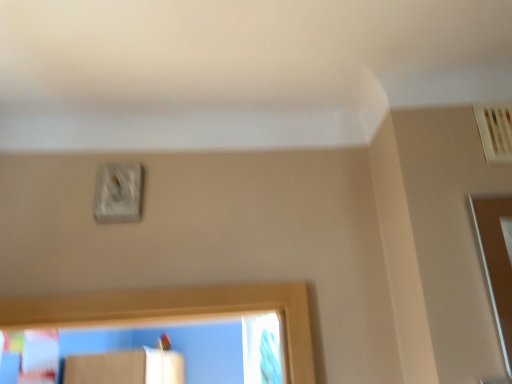
Question: Looking at their shapes, would you say clear glass screen door at right is wider or thinner than white textured switch at upper center?

Choices:
 (A) thin
 (B) wide

Answer: (B)

Question: From the image's perspective, is clear glass screen door at right positioned above or below white textured switch at upper center?

Choices:
 (A) above
 (B) below

Answer: (B)

Question: Considering the relative positions of clear glass screen door at right and white textured switch at upper center in the image provided, is clear glass screen door at right to the left or to the right of white textured switch at upper center?

Choices:
 (A) left
 (B) right

Answer: (B)

Question: Considering the relative positions of white textured switch at upper center and clear glass screen door at right in the image provided, is white textured switch at upper center to the left or to the right of clear glass screen door at right?

Choices:
 (A) left
 (B) right

Answer: (A)

Question: Looking at the image, does white textured switch at upper center seem bigger or smaller compared to clear glass screen door at right?

Choices:
 (A) big
 (B) small

Answer: (B)

Question: Is white textured switch at upper center spatially inside clear glass screen door at right, or outside of it?

Choices:
 (A) outside
 (B) inside

Answer: (A)

Question: From a real-world perspective, is white textured switch at upper center physically located above or below clear glass screen door at right?

Choices:
 (A) below
 (B) above

Answer: (B)